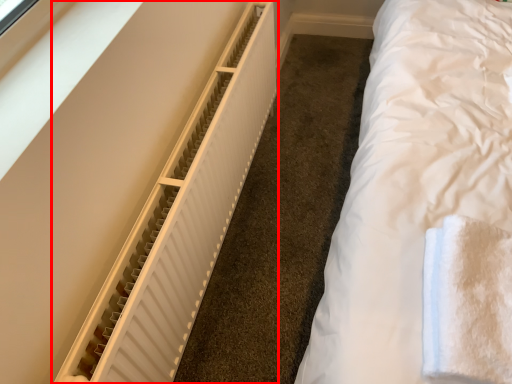
Question: From the image's perspective, what is the correct spatial relationship of radiator (annotated by the red box) in relation to cloth?

Choices:
 (A) above
 (B) below

Answer: (A)